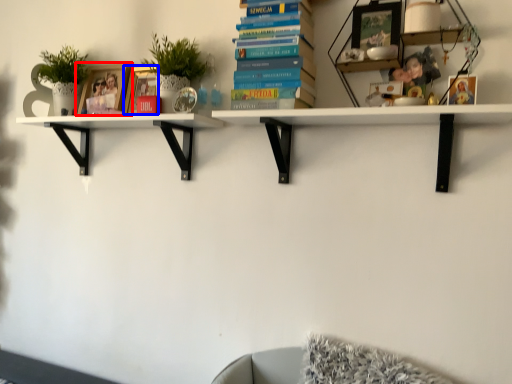
Question: Which point is further to the camera, picture frame (highlighted by a red box) or picture frame (highlighted by a blue box)?

Choices:
 (A) picture frame
 (B) picture frame

Answer: (A)